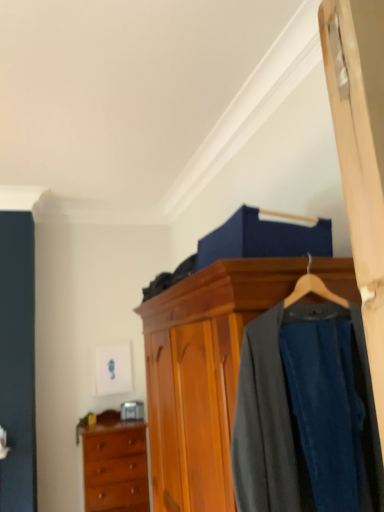
The height and width of the screenshot is (512, 384). What do you see at coordinates (306, 413) in the screenshot?
I see `dark gray wool suit at center` at bounding box center [306, 413].

The image size is (384, 512). I want to click on wooden wardrobe at center, so click(x=202, y=375).

Which object is positioned more to the left, dark gray wool suit at center or wooden wardrobe at center?

From the viewer's perspective, wooden wardrobe at center appears more on the left side.

Is dark gray wool suit at center positioned beyond the bounds of wooden wardrobe at center?

No, most part of dark gray wool suit at center lies within wooden wardrobe at center.

Based on the photo, is dark gray wool suit at center in contact with wooden wardrobe at center?

No.

Is dark gray wool suit at center turned away from wooden wardrobe at center?

Yes, dark gray wool suit at center is positioned with its back facing wooden wardrobe at center.

Is wooden wardrobe at center not near dark gray wool suit at center?

No, there isn't a large distance between wooden wardrobe at center and dark gray wool suit at center.

Which object is further away from the camera taking this photo, wooden wardrobe at center or dark gray wool suit at center?

dark gray wool suit at center is behind.

Considering the positions of objects wooden wardrobe at center and dark gray wool suit at center in the image provided, who is more to the right, wooden wardrobe at center or dark gray wool suit at center?

dark gray wool suit at center is more to the right.

Measure the distance between wooden wardrobe at center and dark gray wool suit at center.

wooden wardrobe at center is 14.27 inches from dark gray wool suit at center.

Considering the relative positions of wooden chest of drawers at lower left and wooden wardrobe at center in the image provided, is wooden chest of drawers at lower left to the left or to the right of wooden wardrobe at center?

wooden chest of drawers at lower left is to the left of wooden wardrobe at center.

Considering the relative sizes of wooden chest of drawers at lower left and wooden wardrobe at center in the image provided, is wooden chest of drawers at lower left taller than wooden wardrobe at center?

No.

Image resolution: width=384 pixels, height=512 pixels. I want to click on cabinetry lying above the wooden chest of drawers at lower left (from the image's perspective), so click(202, 375).

Considering the sizes of objects wooden chest of drawers at lower left and dark gray wool suit at center in the image provided, who is bigger, wooden chest of drawers at lower left or dark gray wool suit at center?

wooden chest of drawers at lower left is bigger.

Is wooden chest of drawers at lower left with dark gray wool suit at center?

They are not placed beside each other.

Does dark gray wool suit at center turn towards wooden chest of drawers at lower left?

No, dark gray wool suit at center is not oriented towards wooden chest of drawers at lower left.

Is there a large distance between dark gray wool suit at center and wooden chest of drawers at lower left?

That's right, there is a large distance between dark gray wool suit at center and wooden chest of drawers at lower left.

What's the angular difference between dark gray wool suit at center and wooden chest of drawers at lower left's facing directions?

The angular difference between dark gray wool suit at center and wooden chest of drawers at lower left is 3.45 degrees.

From the image's perspective, is dark gray wool suit at center on top of wooden chest of drawers at lower left?

Indeed, from the image's perspective, dark gray wool suit at center is shown above wooden chest of drawers at lower left.

Is there a large distance between wooden wardrobe at center and wooden chest of drawers at lower left?

Yes.

Is wooden wardrobe at center facing away from wooden chest of drawers at lower left?

No, wooden wardrobe at center's orientation is not away from wooden chest of drawers at lower left.

Between wooden wardrobe at center and wooden chest of drawers at lower left, which one appears on the right side from the viewer's perspective?

Positioned to the right is wooden wardrobe at center.

From the image's perspective, between wooden wardrobe at center and wooden chest of drawers at lower left, which one is located above?

wooden wardrobe at center, from the image's perspective.

Image resolution: width=384 pixels, height=512 pixels. In the image, there is a dark gray wool suit at center. Find the location of `cabinetry below it (from the image's perspective)`. cabinetry below it (from the image's perspective) is located at coordinates tap(202, 375).

Locate an element on the screen. clothing that appears above the wooden wardrobe at center (from the image's perspective) is located at coordinates (306, 413).

Based on their spatial positions, is wooden chest of drawers at lower left or dark gray wool suit at center further from wooden wardrobe at center?

The object further to wooden wardrobe at center is wooden chest of drawers at lower left.

Considering their positions, is wooden wardrobe at center positioned further to wooden chest of drawers at lower left than dark gray wool suit at center?

The object further to wooden chest of drawers at lower left is dark gray wool suit at center.

From the image, which object appears to be farther from wooden wardrobe at center, dark gray wool suit at center or wooden chest of drawers at lower left?

wooden chest of drawers at lower left.

Looking at this image, looking at the image, which one is located closer to dark gray wool suit at center, wooden chest of drawers at lower left or wooden wardrobe at center?

The object closer to dark gray wool suit at center is wooden wardrobe at center.

Considering their positions, is dark gray wool suit at center positioned further to wooden chest of drawers at lower left than wooden wardrobe at center?

The object further to wooden chest of drawers at lower left is dark gray wool suit at center.

From the picture: Looking at the image, which one is located further to dark gray wool suit at center, wooden wardrobe at center or wooden chest of drawers at lower left?

wooden chest of drawers at lower left is further to dark gray wool suit at center.

The width and height of the screenshot is (384, 512). Find the location of `clothing between wooden wardrobe at center and wooden chest of drawers at lower left in the front-back direction`. clothing between wooden wardrobe at center and wooden chest of drawers at lower left in the front-back direction is located at coordinates (306, 413).